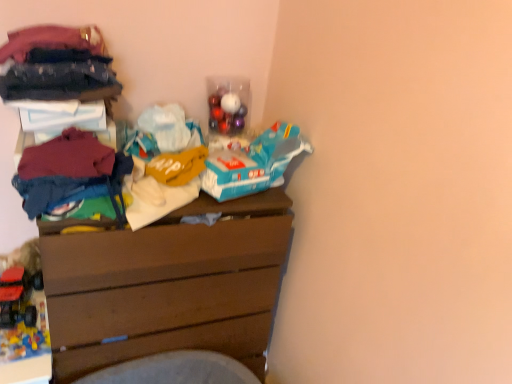
Question: Does rubberized plastic toy truck at lower left, placed as the 2th toy when sorted from bottom to top, lie in front of dark blue fabric at upper left, the 2th clothing from the bottom?

Choices:
 (A) yes
 (B) no

Answer: (B)

Question: Considering the relative sizes of rubberized plastic toy truck at lower left, placed as the 2th toy when sorted from bottom to top, and dark blue fabric at upper left, which is the 2th clothing from top to bottom, in the image provided, is rubberized plastic toy truck at lower left, placed as the 2th toy when sorted from bottom to top, thinner than dark blue fabric at upper left, which is the 2th clothing from top to bottom,?

Choices:
 (A) no
 (B) yes

Answer: (A)

Question: From a real-world perspective, is rubberized plastic toy truck at lower left, placed as the 2th toy when sorted from bottom to top, located beneath dark blue fabric at upper left, which is the 2th clothing from top to bottom?

Choices:
 (A) yes
 (B) no

Answer: (A)

Question: Considering the relative sizes of rubberized plastic toy truck at lower left, placed as the 2th toy when sorted from bottom to top, and dark blue fabric at upper left, the 2th clothing from the bottom, in the image provided, is rubberized plastic toy truck at lower left, placed as the 2th toy when sorted from bottom to top, taller than dark blue fabric at upper left, the 2th clothing from the bottom,?

Choices:
 (A) no
 (B) yes

Answer: (B)

Question: Is rubberized plastic toy truck at lower left, placed as the 2th toy when sorted from bottom to top, next to dark blue fabric at upper left, which is the 2th clothing from top to bottom, and touching it?

Choices:
 (A) no
 (B) yes

Answer: (A)

Question: From a real-world perspective, does rubberized plastic toy truck at lower left, acting as the first toy starting from the top, stand above dark blue fabric at upper left, which is the 2th clothing from top to bottom?

Choices:
 (A) no
 (B) yes

Answer: (A)

Question: Is dark blue fabric at upper left, the 2th clothing from the bottom, to the right of rubberized plastic toy truck at lower left, placed as the 2th toy when sorted from bottom to top, from the viewer's perspective?

Choices:
 (A) yes
 (B) no

Answer: (A)

Question: Does dark blue fabric at upper left, which is the 2th clothing from top to bottom, have a lesser height compared to rubberized plastic toy truck at lower left, acting as the first toy starting from the top?

Choices:
 (A) no
 (B) yes

Answer: (B)

Question: Considering the relative sizes of dark blue fabric at upper left, the 2th clothing from the bottom, and rubberized plastic toy truck at lower left, acting as the first toy starting from the top, in the image provided, is dark blue fabric at upper left, the 2th clothing from the bottom, thinner than rubberized plastic toy truck at lower left, acting as the first toy starting from the top,?

Choices:
 (A) yes
 (B) no

Answer: (A)

Question: Is dark blue fabric at upper left, the 2th clothing from the bottom, positioned beyond the bounds of rubberized plastic toy truck at lower left, placed as the 2th toy when sorted from bottom to top?

Choices:
 (A) no
 (B) yes

Answer: (B)

Question: From a real-world perspective, is dark blue fabric at upper left, which is the 2th clothing from top to bottom, over rubberized plastic toy truck at lower left, acting as the first toy starting from the top?

Choices:
 (A) no
 (B) yes

Answer: (B)

Question: Can you confirm if dark blue fabric at upper left, which is the 2th clothing from top to bottom, is wider than rubberized plastic toy truck at lower left, acting as the first toy starting from the top?

Choices:
 (A) no
 (B) yes

Answer: (A)

Question: Is rubberized plastic toy truck at lower left, placed as the 2th toy when sorted from bottom to top, positioned with its back to brown wooden chest of drawers at center?

Choices:
 (A) no
 (B) yes

Answer: (A)